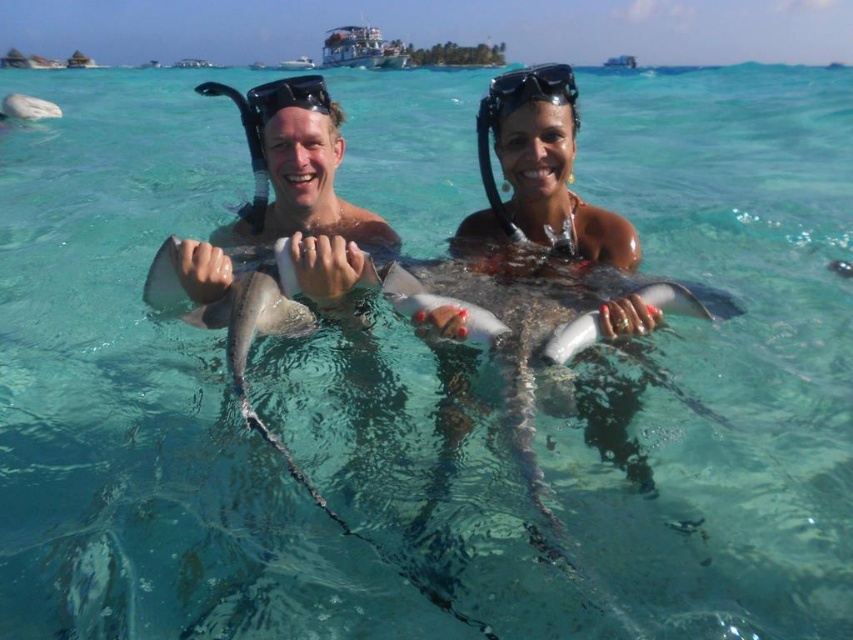
Question: Which point appears closest to the camera in this image?

Choices:
 (A) (276, 88)
 (B) (518, 221)
 (C) (317, 112)

Answer: (A)

Question: Can you confirm if matte gray shark at center is wider than black rubber goggles at upper center?

Choices:
 (A) yes
 (B) no

Answer: (A)

Question: Is matte gray shark at center smaller than black rubber goggles at upper center?

Choices:
 (A) yes
 (B) no

Answer: (B)

Question: Which object is closer to the camera taking this photo?

Choices:
 (A) black matte snorkel mask at upper center
 (B) black rubber goggles at upper center
 (C) matte gray shark at center

Answer: (C)

Question: Can you confirm if matte gray shark at center is smaller than black matte snorkel mask at upper center?

Choices:
 (A) yes
 (B) no

Answer: (B)

Question: Which object is the farthest from the matte white stingray at center?

Choices:
 (A) matte gray shark at center
 (B) black matte snorkel mask at upper center

Answer: (B)